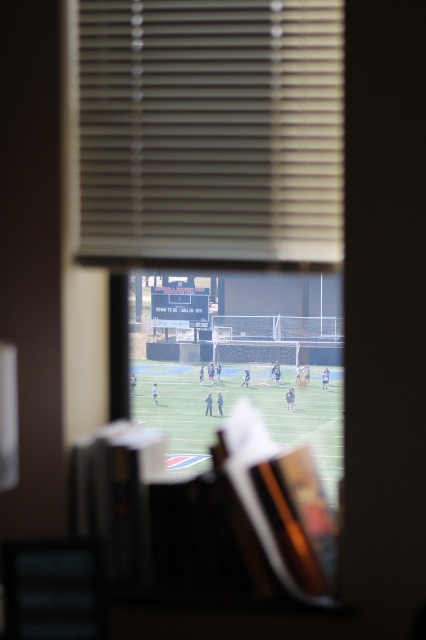
Between matte gray blinds at upper center and green grass football field at center, which one is positioned higher?

matte gray blinds at upper center

Which is below, matte gray blinds at upper center or green grass football field at center?

green grass football field at center is lower down.

Between point (218, 177) and point (169, 420), which one is positioned in front?

Point (218, 177) is in front.

The height and width of the screenshot is (640, 426). Find the location of `matte gray blinds at upper center`. matte gray blinds at upper center is located at coordinates (210, 131).